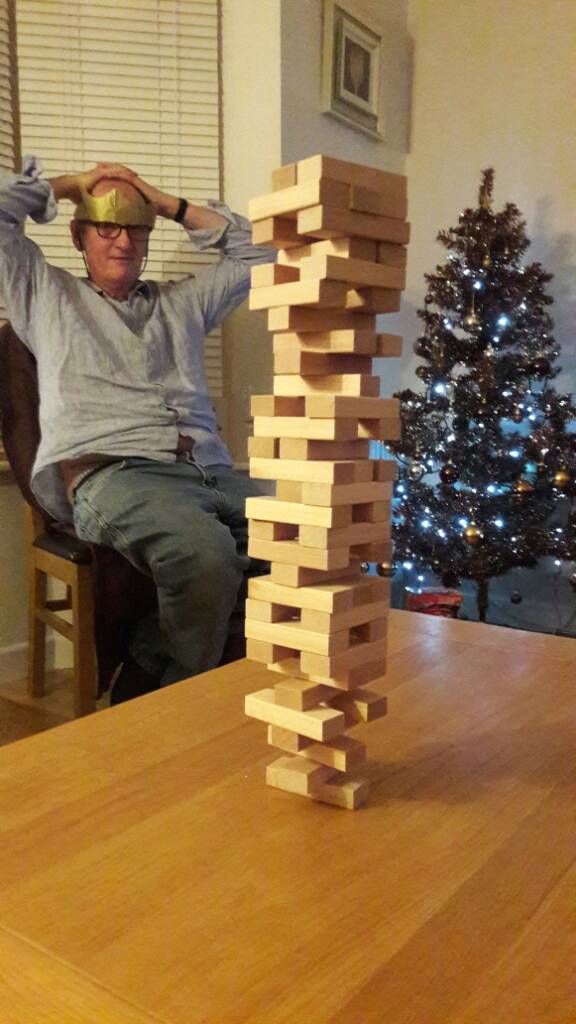
Locate an element on the screen. The width and height of the screenshot is (576, 1024). mini blinds is located at coordinates (125, 144).